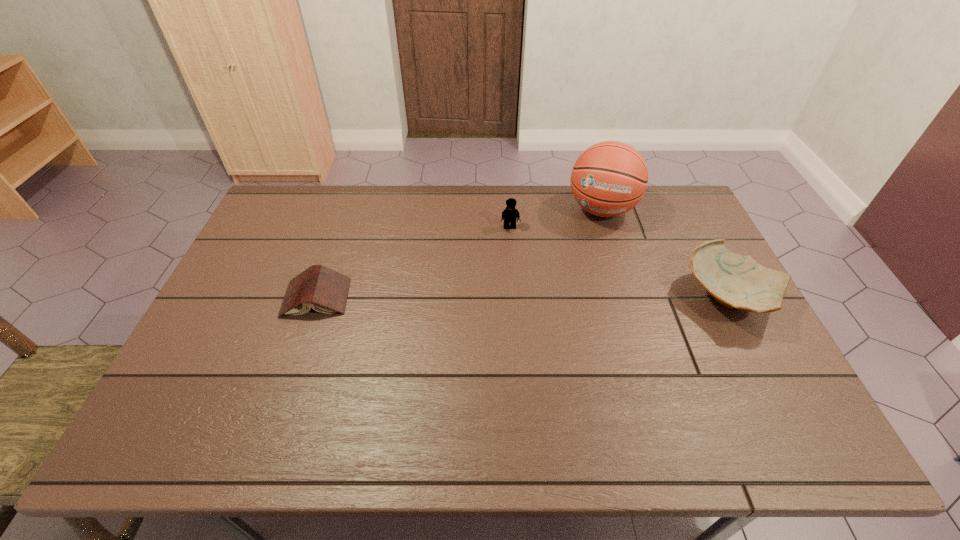
The height and width of the screenshot is (540, 960). Find the location of `vacant region located 0.360m on the front-facing side of the Lego`. vacant region located 0.360m on the front-facing side of the Lego is located at coordinates click(519, 316).

You are a GUI agent. You are given a task and a screenshot of the screen. Output one action in this format:
    pyautogui.click(x=<x>, y=<y>)
    Task: Click on the free space located on the logo side of the tallest object
    The height and width of the screenshot is (540, 960).
    Given the screenshot: What is the action you would take?
    pyautogui.click(x=577, y=291)

Identify the location of vacant space located 0.340m on the logo side of the tallest object. (573, 303).

The image size is (960, 540). What are the coordinates of `blank space located on the logo side of the tallest object` in the screenshot? It's located at (588, 255).

Image resolution: width=960 pixels, height=540 pixels. I want to click on Lego present at the far edge, so (510, 214).

The width and height of the screenshot is (960, 540). What are the coordinates of `basketball situated at the far edge` in the screenshot? It's located at (610, 178).

Find the location of `object at the right edge`. object at the right edge is located at coordinates (735, 281).

In order to click on free space at the far edge of the desktop in this screenshot , I will do `click(332, 191)`.

In the image, there is a desktop. In order to click on vacant space at the near edge in this screenshot , I will do (x=647, y=376).

You are a GUI agent. You are given a task and a screenshot of the screen. Output one action in this format:
    pyautogui.click(x=<x>, y=<y>)
    Task: Click on the free region at the left edge of the desktop
    
    Given the screenshot: What is the action you would take?
    pyautogui.click(x=252, y=250)